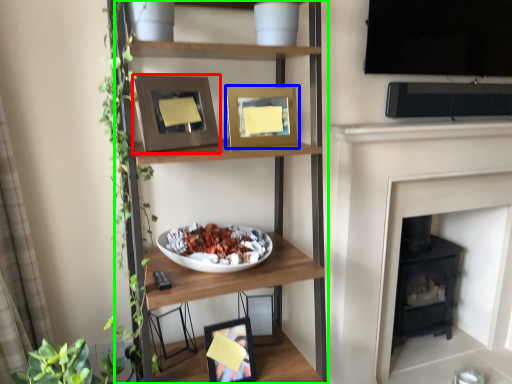
Question: Which object is positioned farthest from picture frame (highlighted by a red box)? Select from picture frame (highlighted by a blue box) and shelf (highlighted by a green box).

Choices:
 (A) picture frame
 (B) shelf

Answer: (A)